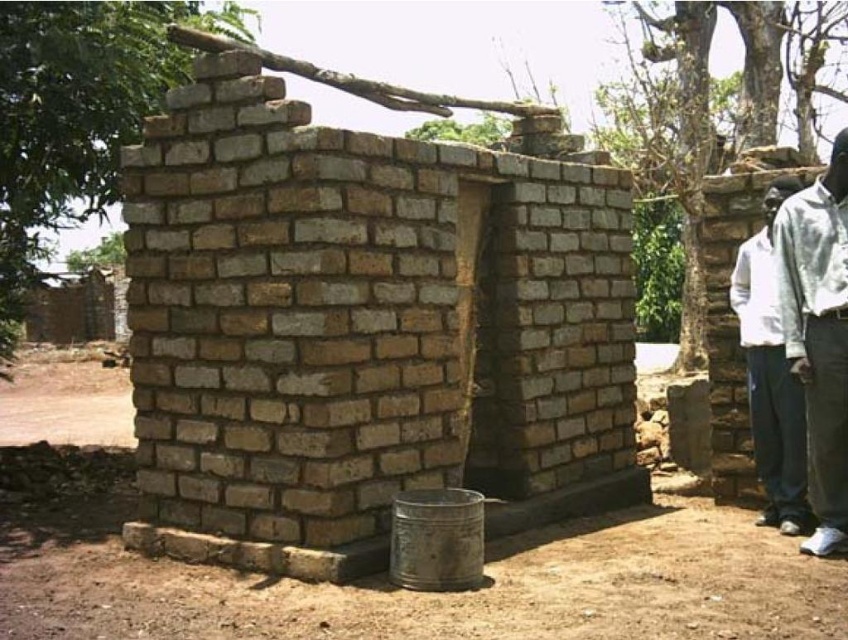
Is light gray shirt at right to the right of white cotton shirt at right from the viewer's perspective?

Yes, light gray shirt at right is to the right of white cotton shirt at right.

Which of these two, light gray shirt at right or white cotton shirt at right, stands shorter?

white cotton shirt at right

The height and width of the screenshot is (640, 848). I want to click on light gray shirt at right, so click(818, 337).

This screenshot has width=848, height=640. I want to click on light gray shirt at right, so click(x=818, y=337).

Who is shorter, brown rough brick wall at center or light gray shirt at right?

light gray shirt at right is shorter.

Does brown rough brick wall at center have a lesser height compared to light gray shirt at right?

No.

Who is more distant from viewer, (394, 172) or (846, 198)?

The point (394, 172) is behind.

Where is `brown rough brick wall at center`? The image size is (848, 640). brown rough brick wall at center is located at coordinates pyautogui.click(x=364, y=330).

Where is `brown rough brick wall at center`? brown rough brick wall at center is located at coordinates (364, 330).

Can you confirm if brown rough brick wall at center is positioned below white cotton shirt at right?

No.

Does point (533, 195) lie behind point (776, 312)?

That is True.

At what (x,y) coordinates should I click in order to perform the action: click on brown rough brick wall at center. Please return your answer as a coordinate pair (x, y). The image size is (848, 640). Looking at the image, I should click on (364, 330).